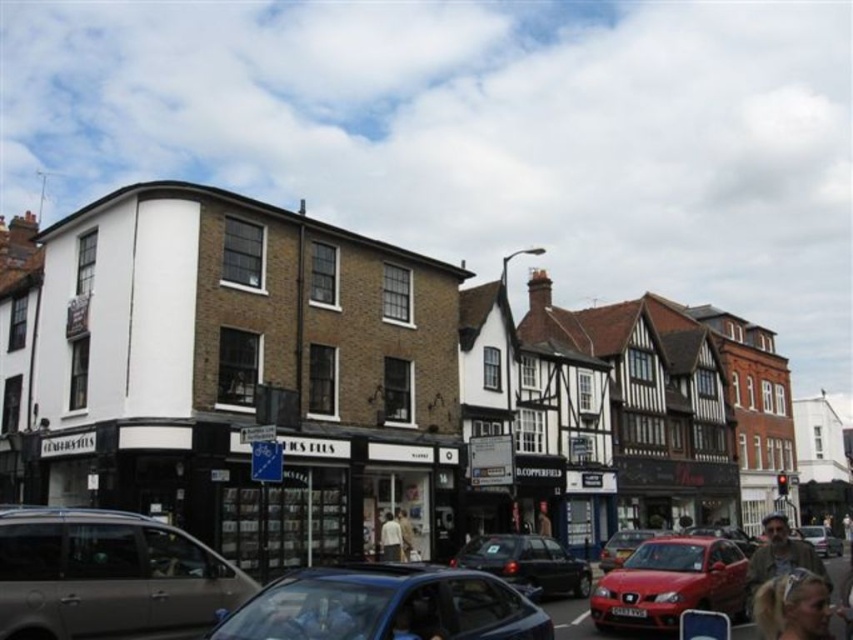
Is point (532, 545) closer to viewer compared to point (601, 556)?

That is True.

Can you confirm if shiny black sedan at center is positioned to the left of matte red car at center?

Yes, shiny black sedan at center is to the left of matte red car at center.

The width and height of the screenshot is (853, 640). I want to click on shiny black sedan at center, so click(x=527, y=563).

Identify the location of shiny black sedan at center. The width and height of the screenshot is (853, 640). (527, 563).

From the picture: Between shiny red car at lower right and light beige fabric shirt at center, which one appears on the right side from the viewer's perspective?

shiny red car at lower right is more to the right.

Who is more distant from viewer, [657,586] or [399,538]?

Positioned behind is point [399,538].

This screenshot has height=640, width=853. What are the coordinates of `shiny red car at lower right` in the screenshot? It's located at (670, 582).

Is matte black car at center shorter than red matte car at center?

Yes, matte black car at center is shorter than red matte car at center.

Who is positioned more to the right, matte black car at center or red matte car at center?

Positioned to the right is red matte car at center.

This screenshot has width=853, height=640. Find the location of `matte black car at center`. matte black car at center is located at coordinates (386, 605).

Find the location of a particular element. matte black car at center is located at coordinates (386, 605).